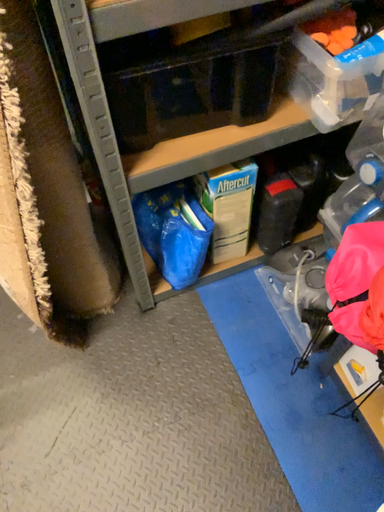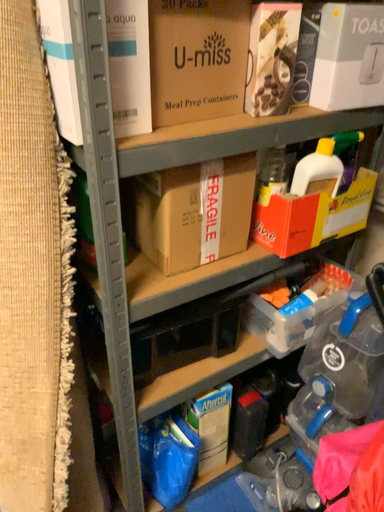
Question: Which way did the camera rotate in the video?

Choices:
 (A) rotated left
 (B) rotated right

Answer: (B)